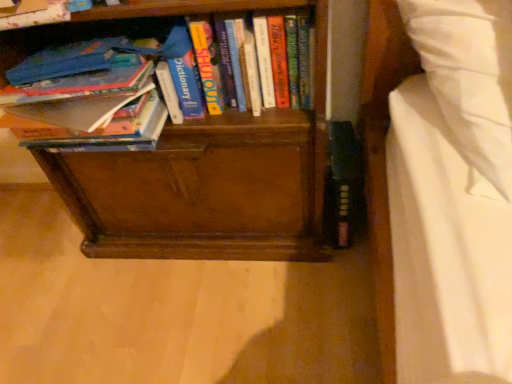
Question: Is the depth of hardcover book at left, which ranks as the 2th book in left-to-right order, greater than that of hardcover book at upper left, which ranks as the 3th book in right-to-left order?

Choices:
 (A) no
 (B) yes

Answer: (B)

Question: Can you confirm if hardcover book at left, which ranks as the 2th book in left-to-right order, is bigger than hardcover book at upper left, which ranks as the 3th book in right-to-left order?

Choices:
 (A) yes
 (B) no

Answer: (A)

Question: From the image's perspective, is hardcover book at left, which ranks as the 2th book in left-to-right order, located beneath hardcover book at upper left, which ranks as the 3th book in right-to-left order?

Choices:
 (A) no
 (B) yes

Answer: (B)

Question: Is hardcover book at left, which ranks as the 2th book in left-to-right order, positioned far away from hardcover book at upper left, which ranks as the 3th book in right-to-left order?

Choices:
 (A) yes
 (B) no

Answer: (B)

Question: From the image's perspective, is hardcover book at left, which ranks as the 2th book in left-to-right order, located above hardcover book at upper left, the 1th book from the left?

Choices:
 (A) no
 (B) yes

Answer: (A)

Question: Is point (264, 46) closer or farther from the camera than point (65, 104)?

Choices:
 (A) farther
 (B) closer

Answer: (A)

Question: Is hardcover book at center, arranged as the 1th book when viewed from the right, taller or shorter than hardcover book at left, which appears as the 2th book when viewed from the right?

Choices:
 (A) tall
 (B) short

Answer: (A)

Question: Visually, is hardcover book at center, placed as the third book when sorted from left to right, positioned to the left or to the right of hardcover book at left, which appears as the 2th book when viewed from the right?

Choices:
 (A) right
 (B) left

Answer: (A)

Question: Based on their sizes in the image, would you say hardcover book at center, arranged as the 1th book when viewed from the right, is bigger or smaller than hardcover book at left, which ranks as the 2th book in left-to-right order?

Choices:
 (A) small
 (B) big

Answer: (A)

Question: Would you say hardcover book at upper left, the 1th book from the left, is to the left or to the right of hardcover book at left, which ranks as the 2th book in left-to-right order, in the picture?

Choices:
 (A) right
 (B) left

Answer: (B)

Question: In terms of size, does hardcover book at upper left, which ranks as the 3th book in right-to-left order, appear bigger or smaller than hardcover book at left, which appears as the 2th book when viewed from the right?

Choices:
 (A) small
 (B) big

Answer: (A)

Question: From the image's perspective, relative to hardcover book at left, which ranks as the 2th book in left-to-right order, is hardcover book at upper left, the 1th book from the left, above or below?

Choices:
 (A) below
 (B) above

Answer: (B)

Question: From a real-world perspective, is hardcover book at upper left, the 1th book from the left, positioned above or below hardcover book at left, which ranks as the 2th book in left-to-right order?

Choices:
 (A) above
 (B) below

Answer: (A)

Question: Would you say hardcover book at upper left, which ranks as the 3th book in right-to-left order, is inside or outside hardcover book at center, placed as the third book when sorted from left to right?

Choices:
 (A) inside
 (B) outside

Answer: (B)

Question: Is point (57, 16) closer or farther from the camera than point (291, 74)?

Choices:
 (A) closer
 (B) farther

Answer: (A)